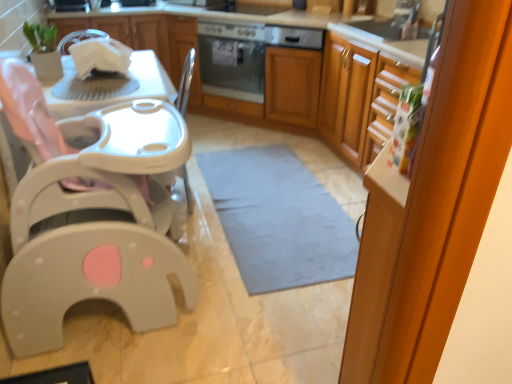
Question: In terms of size, does gray fabric mat at center appear bigger or smaller than white glossy dishwasher at upper center?

Choices:
 (A) small
 (B) big

Answer: (B)

Question: In terms of height, does gray fabric mat at center look taller or shorter compared to white glossy dishwasher at upper center?

Choices:
 (A) tall
 (B) short

Answer: (B)

Question: Which object is the farthest from the transparent glass screen door at right?

Choices:
 (A) gray fabric mat at center
 (B) satin silver oven at center
 (C) white plastic baby carriage at left
 (D) wooden cabinets at center, arranged as the 1th cabinetry when viewed from the right
 (E) white glossy cabinet at upper left, the 1th cabinetry when ordered from left to right

Answer: (E)

Question: Considering the real-world distances, which object is closest to the white glossy dishwasher at upper center?

Choices:
 (A) wooden cabinets at center, arranged as the 1th cabinetry when viewed from the right
 (B) transparent glass screen door at right
 (C) gray fabric mat at center
 (D) white plastic baby carriage at left
 (E) satin silver oven at center

Answer: (A)